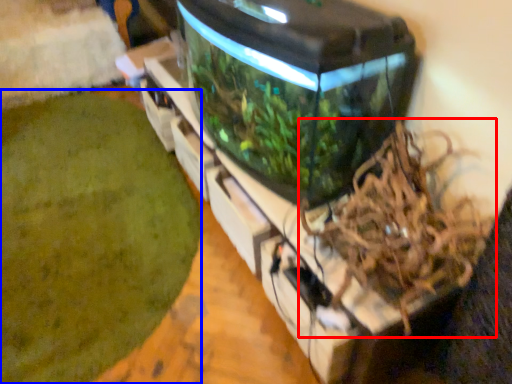
Question: Which of the following is the closest to the observer, bird nest (highlighted by a red box) or debris (highlighted by a blue box)?

Choices:
 (A) bird nest
 (B) debris

Answer: (A)